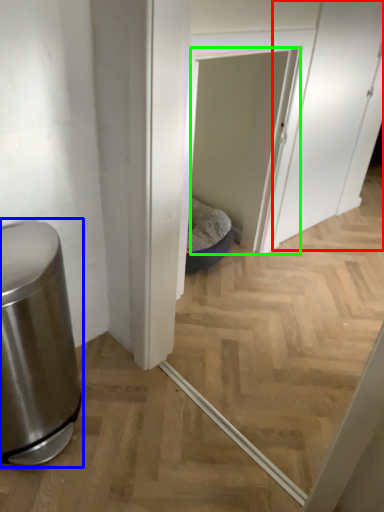
Question: Based on their relative distances, which object is nearer to screen door (highlighted by a red box)? Choose from waste container (highlighted by a blue box) and screen door (highlighted by a green box).

Choices:
 (A) waste container
 (B) screen door

Answer: (B)